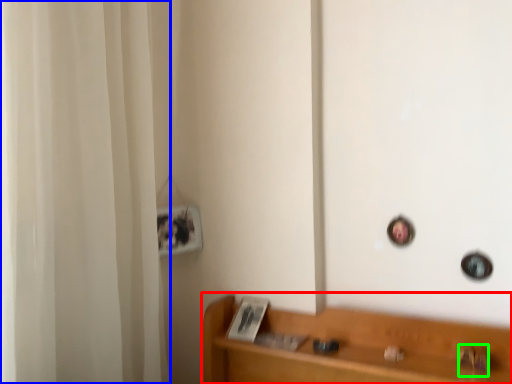
Question: Based on their relative distances, which object is farther from furniture (highlighted by a red box)? Choose from shower curtain (highlighted by a blue box) and door handle (highlighted by a green box).

Choices:
 (A) shower curtain
 (B) door handle

Answer: (A)